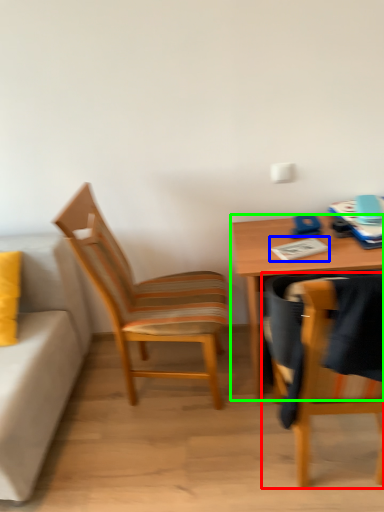
Question: Which object is positioned farthest from chair (highlighted by a red box)? Select from notepad (highlighted by a blue box) and desk (highlighted by a green box).

Choices:
 (A) notepad
 (B) desk

Answer: (A)